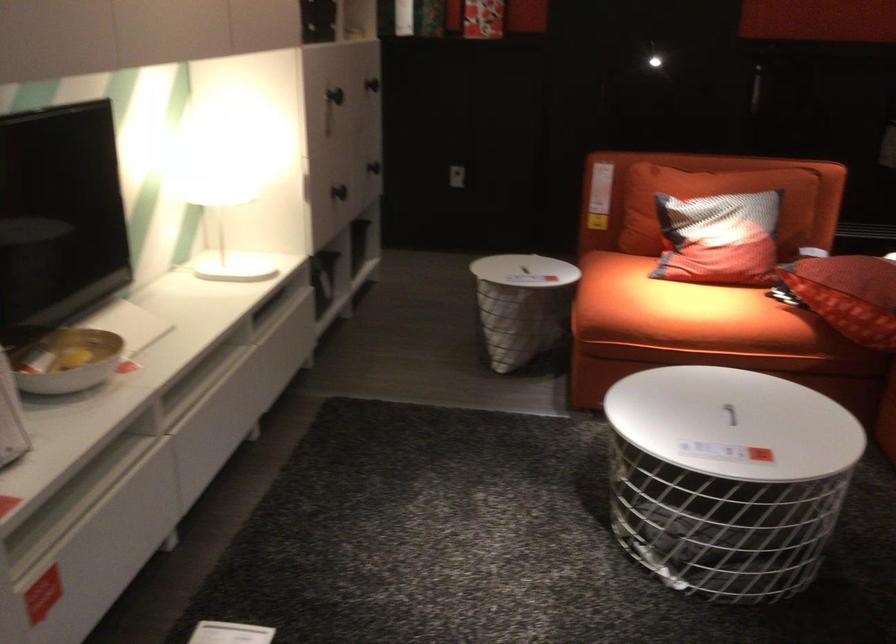
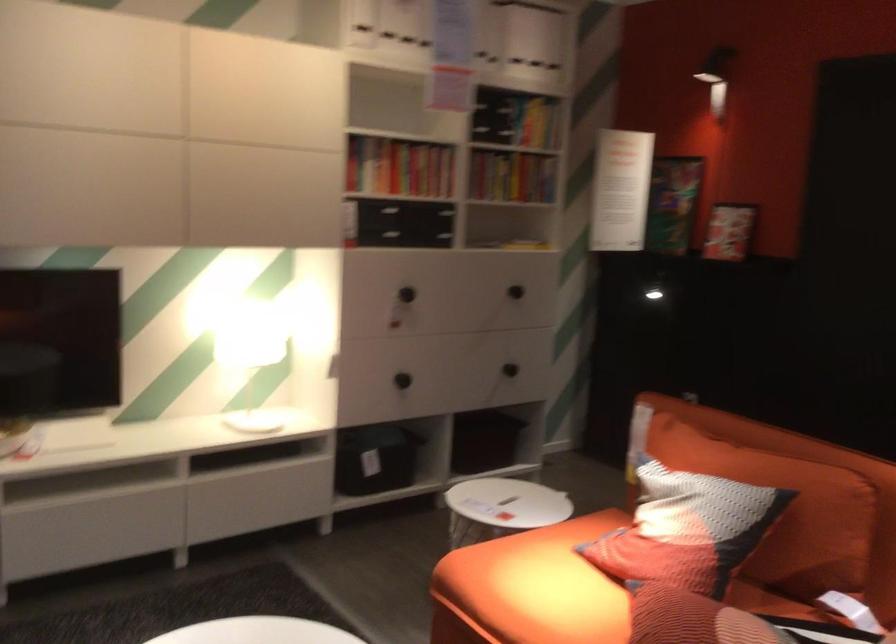
In the second image, find the point that corresponds to [334,104] in the first image.

(407, 294)